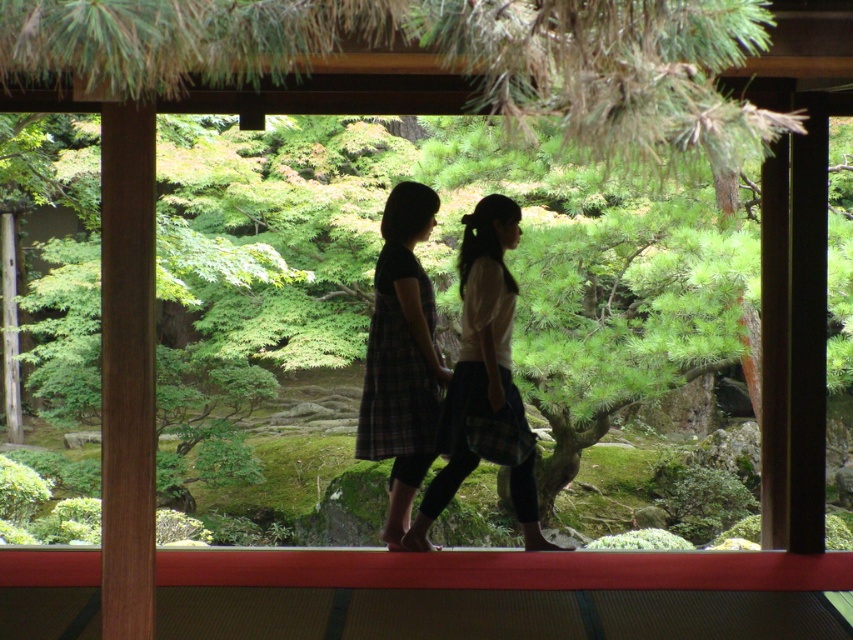
You are standing inside a traditional Japanese room and see two people walking on a veranda. They are both wearing plaid clothing. Which one is closer to the garden? The options are the silhouette plaid skirt at center and the plaid fabric dress at center.

The silhouette plaid skirt at center is to the right of plaid fabric dress at center. Since they are walking side by side on the veranda, the one on the right would be closer to the garden if the garden is to the right side of the scene. However, without explicit information about the garden location, the answer can only state their relative positions. The plaid fabric dress at center is to the left of the silhouette plaid skirt at center, so if the garden is on the right, the skirt is closer.

You are standing inside the traditional Japanese room looking out. There are two points marked in the scene. Which point, point (515, 218) or point (370, 451), is closer to you?

Point (515, 218) is closer to the camera than point (370, 451), so it is closer to you.